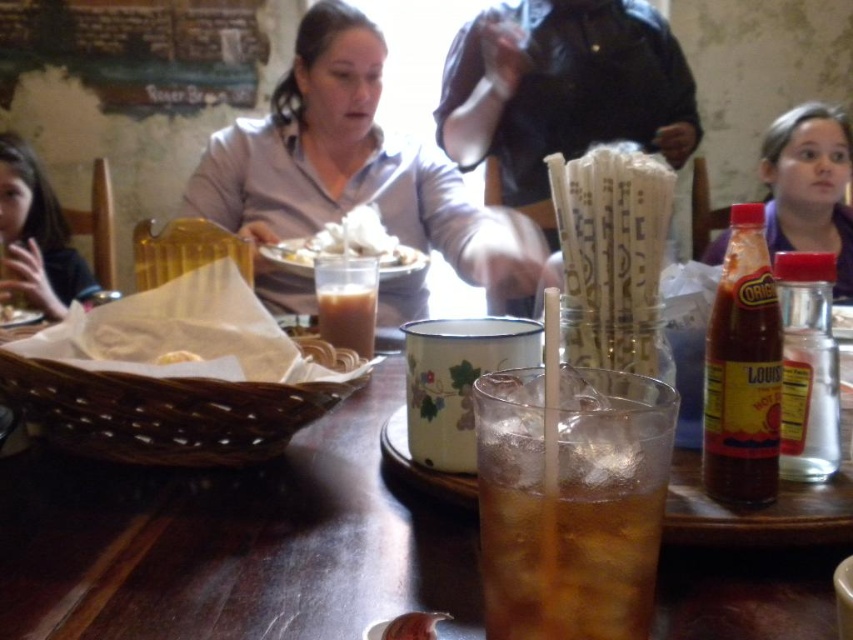
Does brown glass bottle at right appear on the right side of dark brown hair at left?

Correct, you'll find brown glass bottle at right to the right of dark brown hair at left.

Which is more to the left, brown glass bottle at right or dark brown hair at left?

dark brown hair at left

Image resolution: width=853 pixels, height=640 pixels. I want to click on brown glass bottle at right, so click(741, 369).

Which is in front, point (363, 230) or point (410, 632)?

Point (410, 632) is more forward.

The width and height of the screenshot is (853, 640). What do you see at coordinates (349, 241) in the screenshot?
I see `white fluffy bread at center` at bounding box center [349, 241].

The image size is (853, 640). What do you see at coordinates (349, 241) in the screenshot?
I see `white fluffy bread at center` at bounding box center [349, 241].

Where is `white fluffy bread at center`? This screenshot has height=640, width=853. white fluffy bread at center is located at coordinates (349, 241).

Can you confirm if matte purple shirt at upper right is positioned to the left of brown liquid at center?

In fact, matte purple shirt at upper right is to the right of brown liquid at center.

Is point (773, 163) closer to camera compared to point (321, 307)?

No, (773, 163) is further to viewer.

Is point (785, 205) positioned before point (315, 291)?

No, (785, 205) is further to viewer.

Identify the location of matte purple shirt at upper right. (809, 186).